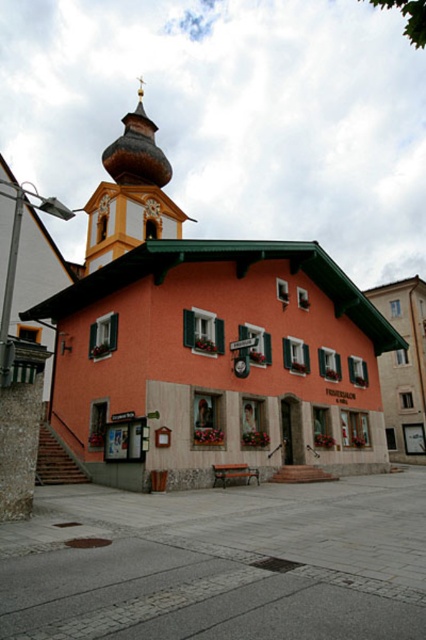
Question: Among these objects, which one is nearest to the camera?

Choices:
 (A) gray concrete plaza at lower center
 (B) orange painted wooden church at center

Answer: (A)

Question: Is orange painted wooden church at center positioned at the back of gold textured spire at upper center?

Choices:
 (A) yes
 (B) no

Answer: (B)

Question: Which object is closer to the camera taking this photo?

Choices:
 (A) gray concrete plaza at lower center
 (B) gold textured spire at upper center
 (C) orange painted wooden church at center

Answer: (A)

Question: Is gold textured spire at upper center to the right of metallic clock at center from the viewer's perspective?

Choices:
 (A) no
 (B) yes

Answer: (A)

Question: Based on their relative distances, which object is nearer to the gold textured spire at upper center?

Choices:
 (A) gray concrete plaza at lower center
 (B) orange painted wooden church at center
 (C) metallic clock at center

Answer: (B)

Question: Is gold textured spire at upper center thinner than metallic clock at center?

Choices:
 (A) yes
 (B) no

Answer: (B)